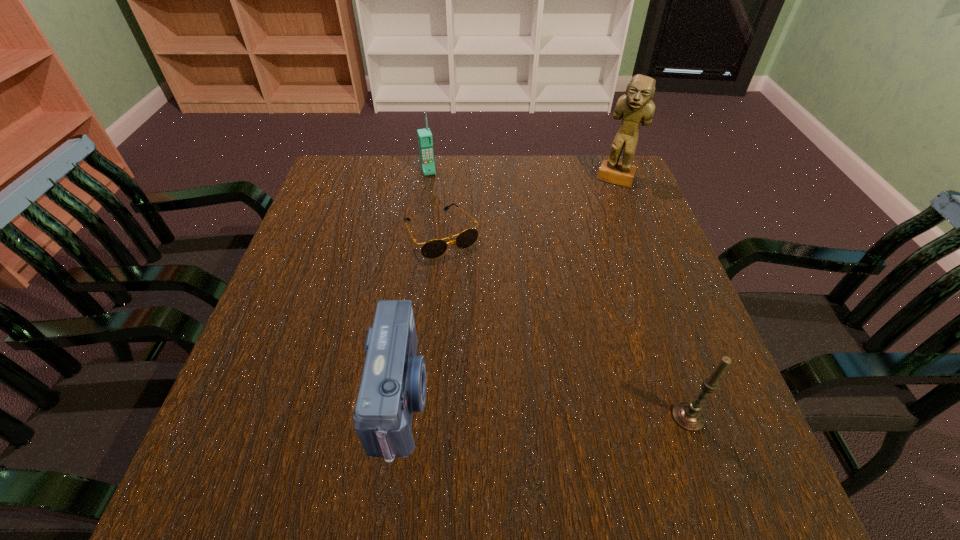
Locate an element on the screen. This screenshot has height=540, width=960. vacant space positioned 0.190m on the keypad of the cellular telephone is located at coordinates (444, 214).

Where is `free location located 0.380m on the front-facing side of the third farthest object`? Image resolution: width=960 pixels, height=540 pixels. free location located 0.380m on the front-facing side of the third farthest object is located at coordinates (538, 386).

Where is `vacant area situated on the front-facing side of the third farthest object`? vacant area situated on the front-facing side of the third farthest object is located at coordinates (465, 272).

At what (x,y) coordinates should I click in order to perform the action: click on free space located 0.400m on the front-facing side of the third farthest object. Please return your answer as a coordinate pair (x, y). This screenshot has width=960, height=540. Looking at the image, I should click on (543, 395).

Image resolution: width=960 pixels, height=540 pixels. In order to click on vacant space located on the front-facing side of the tallest object in this screenshot , I will do `click(585, 260)`.

Where is `vacant space located 0.280m on the front-facing side of the tallest object`? The width and height of the screenshot is (960, 540). vacant space located 0.280m on the front-facing side of the tallest object is located at coordinates (588, 249).

The image size is (960, 540). Identify the location of vacant space situated 0.090m on the front-facing side of the tallest object. (605, 206).

I want to click on cellular telephone that is at the far edge, so click(425, 141).

Identify the location of figurine located at the far edge. The image size is (960, 540). point(636,106).

The height and width of the screenshot is (540, 960). I want to click on camera at the near edge, so click(393, 385).